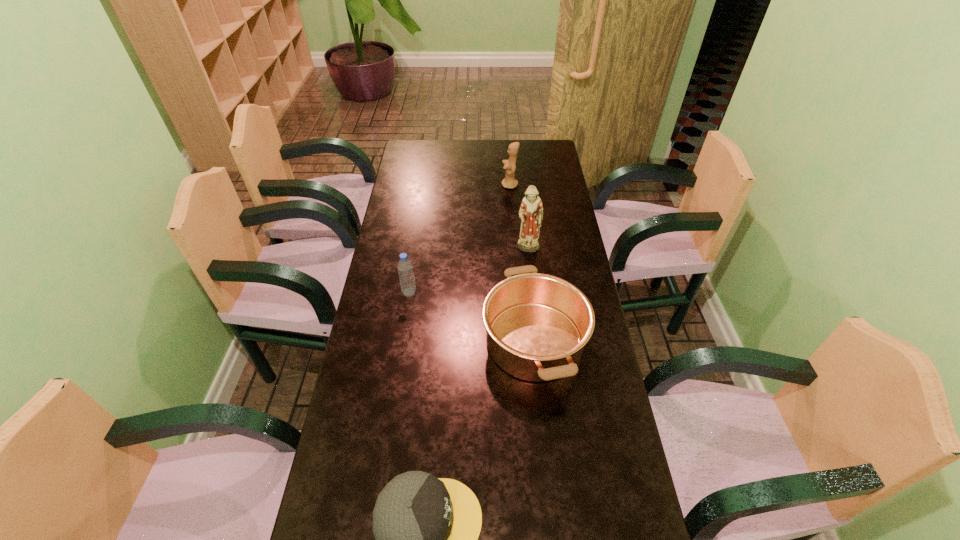
Locate an element on the screen. The image size is (960, 540). vacant space in between the shorter figurine and the tallest object is located at coordinates (519, 218).

Where is `empty location between the farthest object and the fourth tallest object`? The image size is (960, 540). empty location between the farthest object and the fourth tallest object is located at coordinates (522, 263).

You are a GUI agent. You are given a task and a screenshot of the screen. Output one action in this format:
    pyautogui.click(x=<x>, y=<y>)
    Task: Click on the free space between the taller figurine and the third tallest object
    The height and width of the screenshot is (540, 960).
    Given the screenshot: What is the action you would take?
    pyautogui.click(x=468, y=271)

Locate which object ranks second in proximity to the third shortest object. Please provide its 2D coordinates. Your answer should be formatted as a tuple, i.e. [(x, y)], where the tuple contains the x and y coordinates of a point satisfying the conditions above.

[(531, 210)]

You are a GUI agent. You are given a task and a screenshot of the screen. Output one action in this format:
    pyautogui.click(x=<x>, y=<y>)
    Task: Click on the object that is the closest to the fourth tallest object
    The height and width of the screenshot is (540, 960).
    Given the screenshot: What is the action you would take?
    pyautogui.click(x=531, y=210)

Locate an element on the screen. vacant space that satisfies the following two spatial constraints: 1. on the front side of the saucepan; 2. on the right side of the third shortest object is located at coordinates [x=402, y=341].

The image size is (960, 540). I want to click on vacant space that satisfies the following two spatial constraints: 1. on the front-facing side of the farther figurine; 2. on the front side of the third tallest object, so click(518, 292).

This screenshot has width=960, height=540. What are the coordinates of `free space that satisfies the following two spatial constraints: 1. on the front-facing side of the fourth tallest object; 2. on the left side of the farthest object` in the screenshot? It's located at (522, 341).